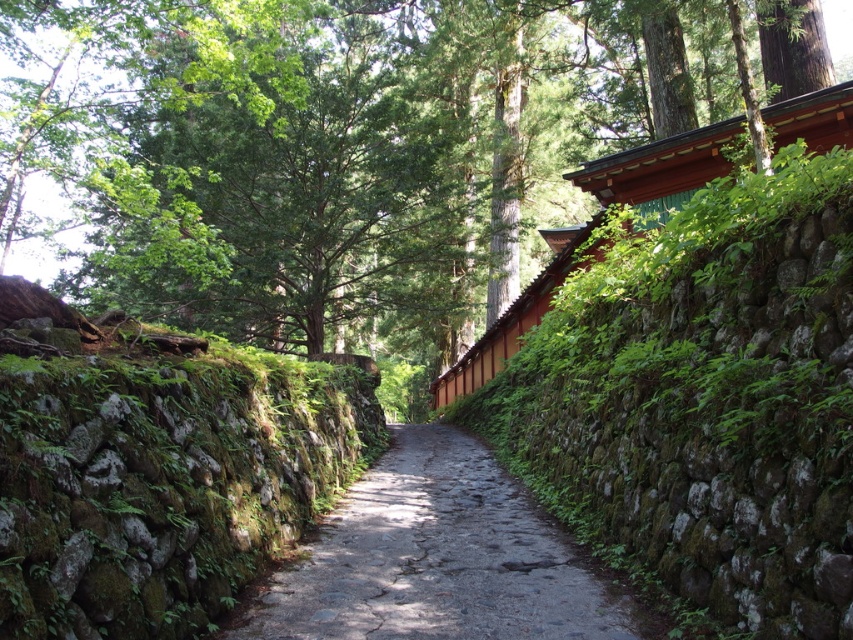
You are standing at the entrance of the pathway and want to locate the green leafy tree at upper center. According to the coordinates provided, where should you look in relation to the center of the image?

The green leafy tree at upper center is located at coordinates point 0.234 on the x axis and 0.368 on the y axis, so you should look slightly to the left and above the center of the image.

You are standing on the pathway and want to take a photo of both the point at coordinates point (32,234) and the point at coordinates point (260,369). Which point will appear closer to the camera in the photo?

Point (32,234) is further to the camera than point (260,369), so it will appear closer to the camera in the photo.